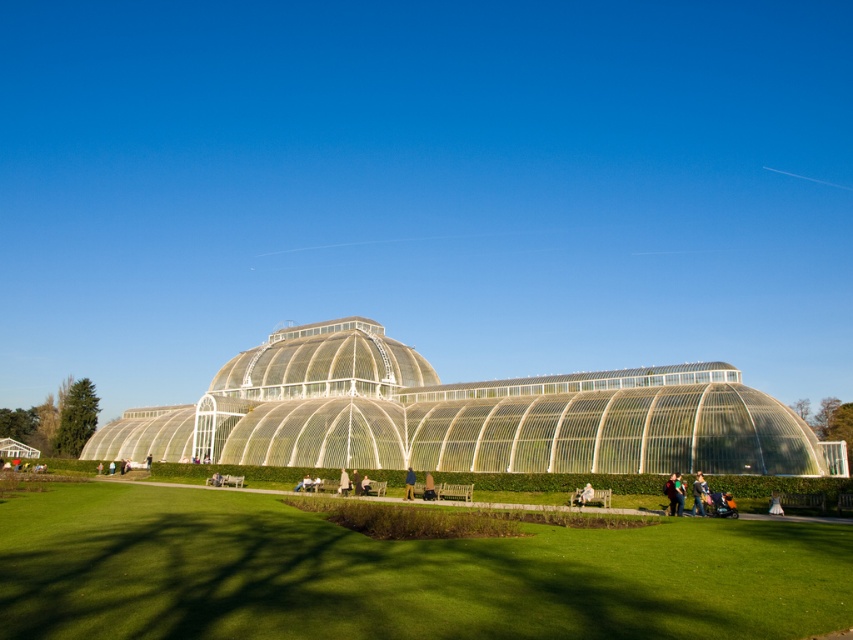
Who is more forward, (413, 480) or (344, 470)?

Point (413, 480)

Between brown leather jacket at center and white fabric person at center, which one appears on the left side from the viewer's perspective?

From the viewer's perspective, white fabric person at center appears more on the left side.

Does point (413, 493) come behind point (339, 492)?

That is False.

This screenshot has height=640, width=853. Find the location of `brown leather jacket at center`. brown leather jacket at center is located at coordinates (409, 484).

Does dark blue jacket at center have a larger size compared to blue denim dress at lower right?

Yes, dark blue jacket at center is bigger than blue denim dress at lower right.

Is point (666, 499) positioned after point (775, 509)?

That is True.

At what (x,y) coordinates should I click in order to perform the action: click on dark blue jacket at center. Please return your answer as a coordinate pair (x, y). Image resolution: width=853 pixels, height=640 pixels. Looking at the image, I should click on coord(672,496).

Locate an element on the screen. This screenshot has width=853, height=640. dark blue jacket at center is located at coordinates (672, 496).

Between transparent glass conservatory at center and dark blue jacket at center, which one is positioned higher?

transparent glass conservatory at center

Which is more to the right, transparent glass conservatory at center or dark blue jacket at center?

From the viewer's perspective, dark blue jacket at center appears more on the right side.

Is point (317, 324) farther from viewer compared to point (669, 513)?

Yes, it is.

You are a GUI agent. You are given a task and a screenshot of the screen. Output one action in this format:
    pyautogui.click(x=<x>, y=<y>)
    Task: Click on the transparent glass conservatory at center
    This screenshot has height=640, width=853.
    Given the screenshot: What is the action you would take?
    pyautogui.click(x=463, y=416)